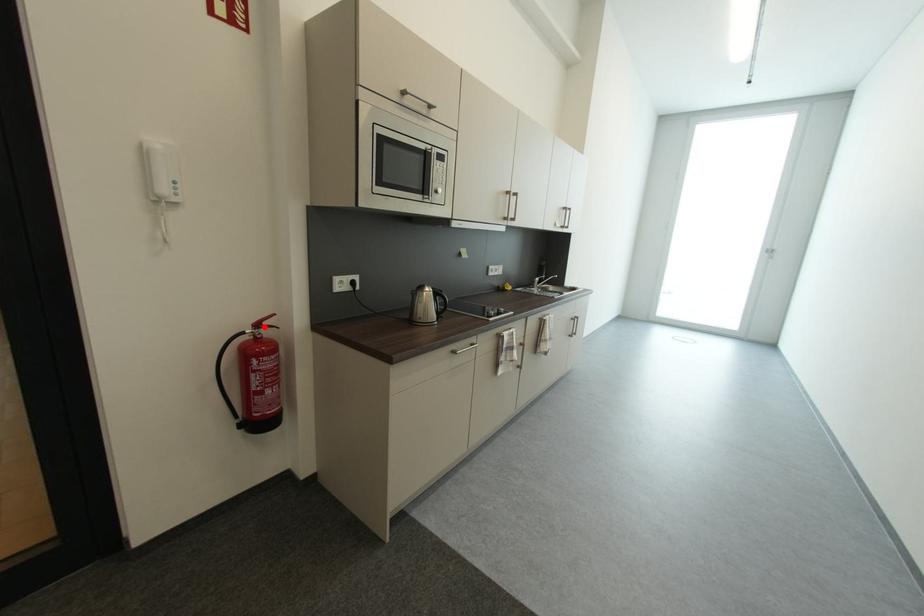
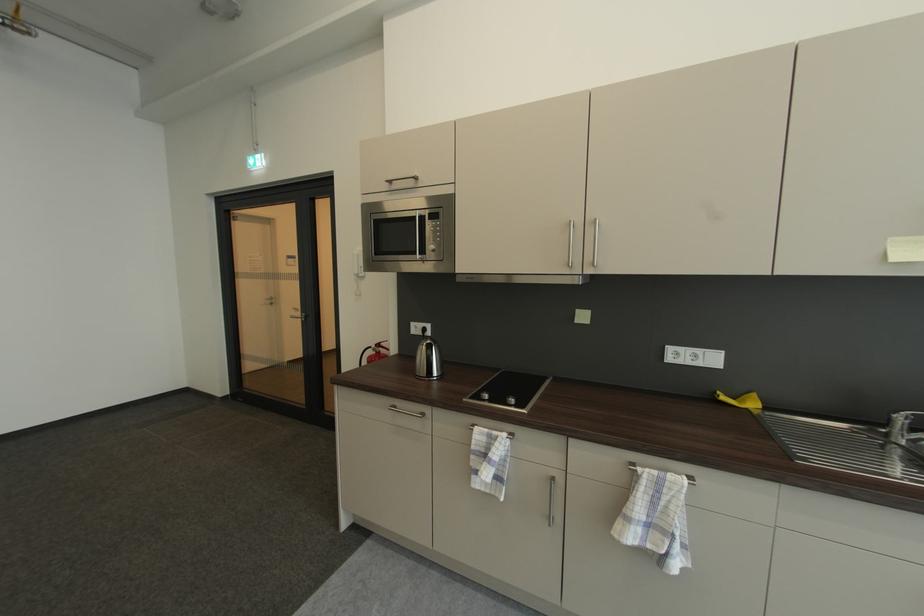
In the second image, find the point that corresponds to the highlighted location in the first image.

(384, 347)